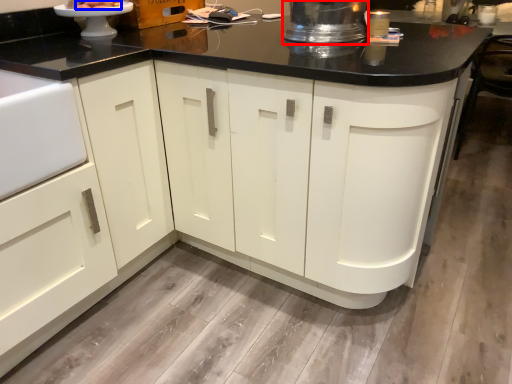
Question: Which object is closer to the camera taking this photo, appliance (highlighted by a red box) or food (highlighted by a blue box)?

Choices:
 (A) appliance
 (B) food

Answer: (A)